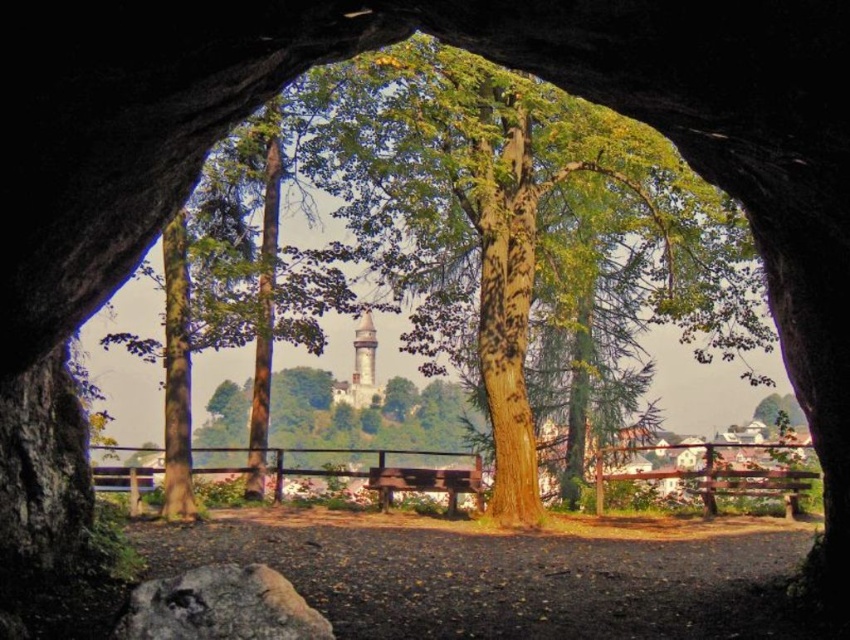
You are standing inside the tree trunk archway looking out. There is a green rough bark tree at center and a wooden park bench at center. Which object is positioned to the right side when viewed from your perspective?

The green rough bark tree at center is positioned to the right of the wooden park bench at center, so the green rough bark tree at center is on the right side.

You are standing inside the tree trunk tunnel and want to walk towards the stone tower at center. Which direction should you move relative to the green rough bark tree at center?

You should move to the left of the green rough bark tree at center to reach the stone tower at center since the green rough bark tree at center is positioned on the right side of the stone tower at center.